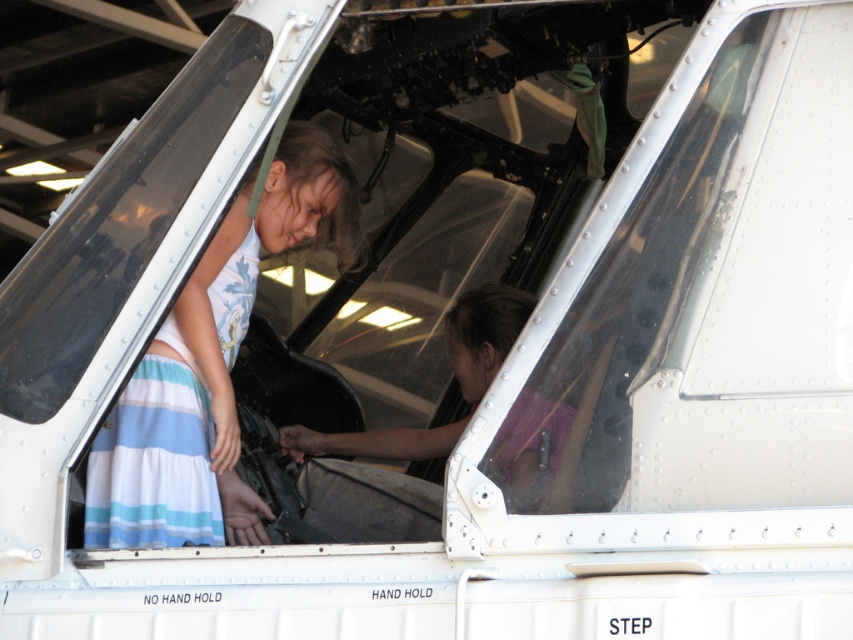
You are an aviation safety inspector examining the cockpit of this aircraft. You notice two crew members inside. The first is wearing a striped cotton dress at lower left, and the second is wearing a pink matte shirt at center. Based on the size of their clothing, which crew member might require a larger safety harness? Explain your reasoning.

The striped cotton dress at lower left is bigger than the pink matte shirt at center, so the crew member wearing the striped cotton dress at lower left likely requires a larger safety harness to accommodate their clothing size.